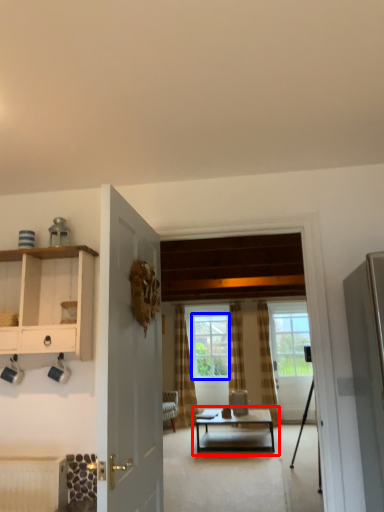
Question: Which point is closer to the camera, coffee table (highlighted by a red box) or window (highlighted by a blue box)?

Choices:
 (A) coffee table
 (B) window

Answer: (A)